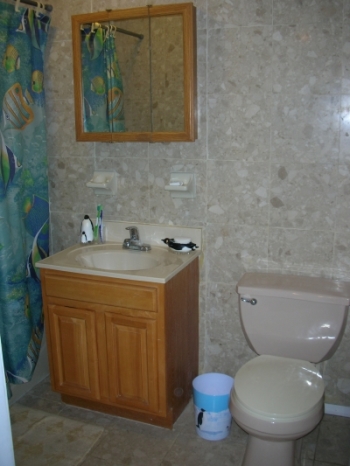
Identify the location of cabinet doors. (64, 360), (125, 367).